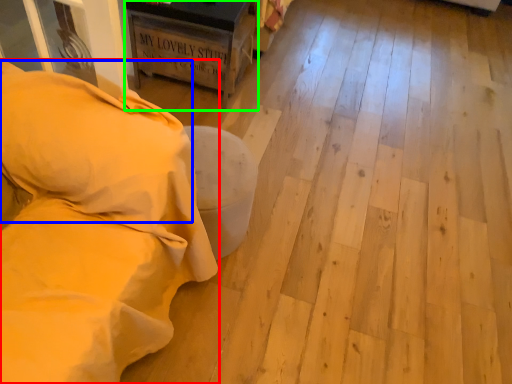
Question: Considering the real-world distances, which object is farthest from furniture (highlighted by a red box)? pillow (highlighted by a blue box) or furniture (highlighted by a green box)?

Choices:
 (A) pillow
 (B) furniture

Answer: (B)